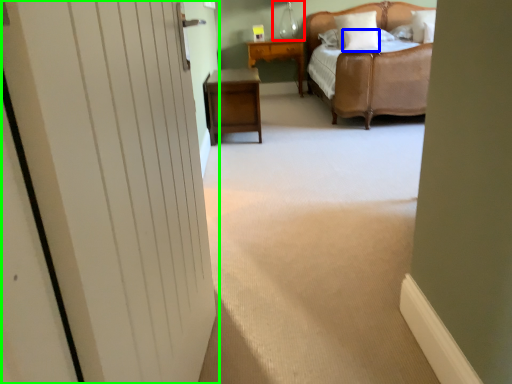
Question: Estimate the real-world distances between objects in this image. Which object is closer to table lamp (highlighted by a red box), pillow (highlighted by a blue box) or door (highlighted by a green box)?

Choices:
 (A) pillow
 (B) door

Answer: (A)